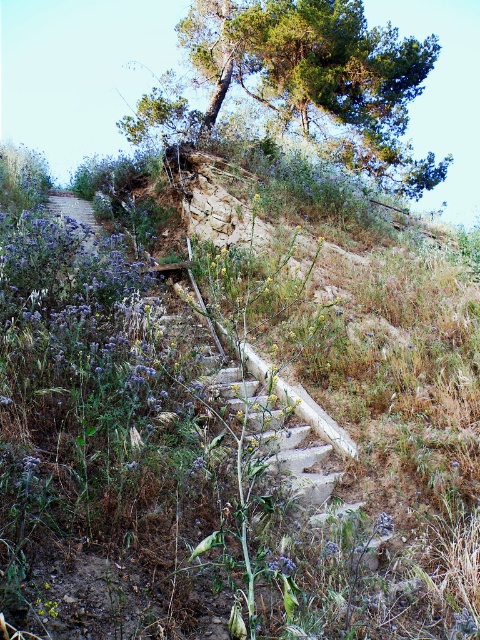
You are hiking up the stone steps and want to take a photo of both the green leafy tree at upper center and the purple floral trail at upper left. Which object should you position closer to the camera to include both in the frame?

You should position the green leafy tree at upper center closer to the camera since it is already closer to you than the purple floral trail at upper left, allowing both to be in the frame.

You are standing at the bottom of the stone steps and want to reach the green leafy tree at upper center. According to the coordinates provided, in which direction should you move relative to the steps?

The green leafy tree at upper center is located at coordinates point (305, 80), so you should move upward along the stone steps to reach it.

You are standing at the bottom of the stone steps on the hillside. You notice a green leafy tree marked by point (x=305, y=80). In which direction should you walk to reach it?

The green leafy tree at upper center is represented by point (x=305, y=80). Since the point is at upper center, you should walk upwards towards the center of the hillside to reach it.